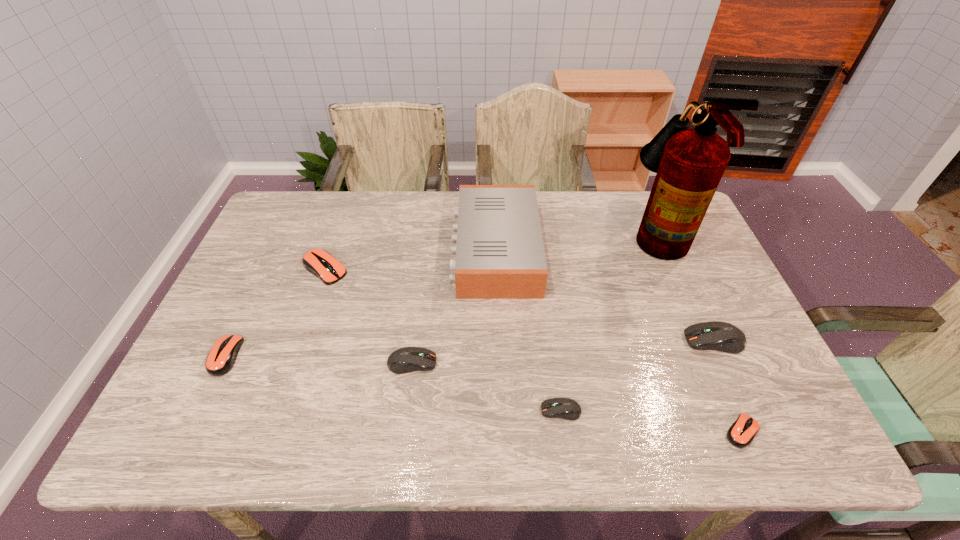
What are the coordinates of `the leftmost object` in the screenshot? It's located at (221, 358).

Find the location of a particular element. The width and height of the screenshot is (960, 540). the third computer mouse from right to left is located at coordinates (565, 408).

Where is `the nearest dark computer equipment`? Image resolution: width=960 pixels, height=540 pixels. the nearest dark computer equipment is located at coordinates (565, 408).

The width and height of the screenshot is (960, 540). Identify the location of the shortest object. (741, 433).

This screenshot has width=960, height=540. What are the coordinates of `the shortest computer mouse` in the screenshot? It's located at (741, 433).

What are the coordinates of `free space located 0.350m at the nozzle of the fire extinguisher` in the screenshot? It's located at (523, 232).

This screenshot has width=960, height=540. Identify the location of vacant point located at the nozzle of the fire extinguisher. (572, 232).

I want to click on vacant space situated 0.400m at the nozzle of the fire extinguisher, so click(507, 232).

Locate an element on the screen. This screenshot has height=540, width=960. free region located 0.400m on the control panel of the seventh shortest object is located at coordinates (322, 249).

Image resolution: width=960 pixels, height=540 pixels. What are the coordinates of `vacant space located on the control panel of the seventh shortest object` in the screenshot? It's located at (357, 249).